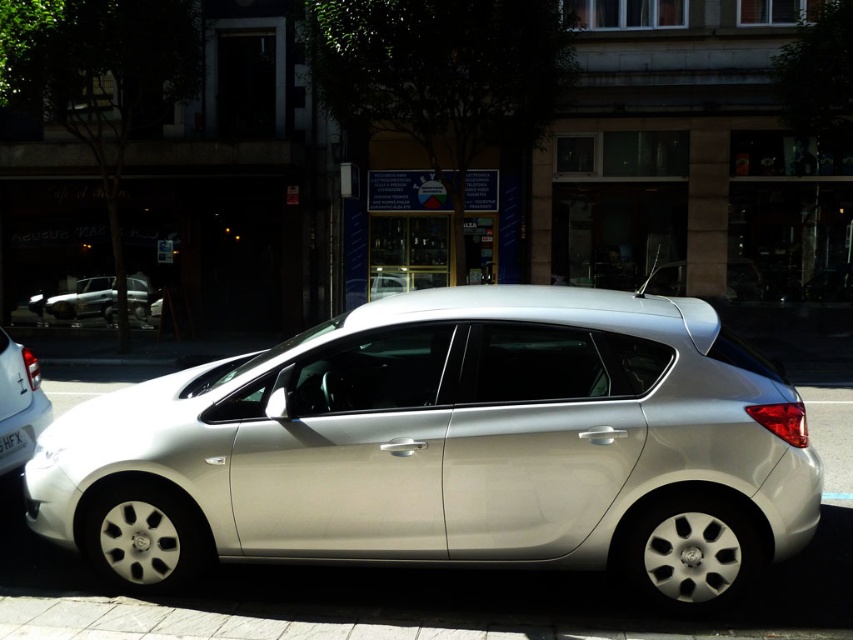
You are a delivery person with a 1.5 meter wide delivery cart. You need to park your cart between the satin silver car at center and the nearest building. Is there enough space for your cart?

The satin silver car at center is 3.61 meters away from the camera. However, the distance between the car and the nearest building isn not specified in the provided information. Therefore, it is impossible to determine if there is enough space for the 1.5 meter wide delivery cart without additional details about the building proximity.

From the picture: You are a photographer taking a picture of the satin silver car at center and the white plastic license plate at center. Which object will appear larger in your photo?

The satin silver car at center will appear larger in the photo because it is closer to the viewer than the white plastic license plate at center.

You are a delivery driver who needs to park your truck between the silver metallic hatchback at lower left and the silver metallic hatchback at center. Your truck is 5 meters long. Can you fit your truck in the space between them?

The silver metallic hatchback at lower left is narrower than the silver metallic hatchback at center, but the distance between them isn not provided. Without knowing the actual space between the two cars, it is impossible to determine if the truck can fit.